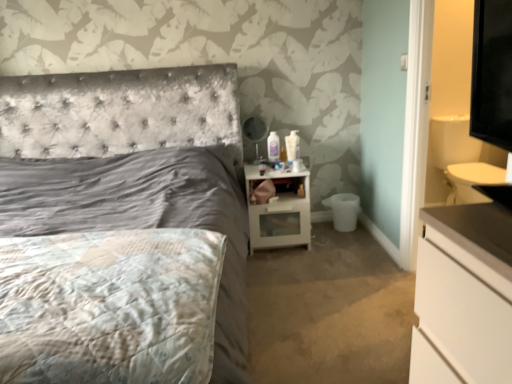
Question: Does point (156, 145) appear closer or farther from the camera than point (293, 153)?

Choices:
 (A) closer
 (B) farther

Answer: (A)

Question: From the image's perspective, is satin gray bed at center above or below white glossy lotion at upper center?

Choices:
 (A) below
 (B) above

Answer: (A)

Question: Which is farther from the fluffy white mattress at lower left?

Choices:
 (A) satin gray bed at center
 (B) matte black mirror at upper right
 (C) white glossy lotion at upper center
 (D) white glossy nightstand at center

Answer: (B)

Question: Which of these objects is positioned farthest from the fluffy white mattress at lower left?

Choices:
 (A) satin gray bed at center
 (B) matte black mirror at upper right
 (C) white glossy nightstand at center
 (D) white glossy lotion at upper center

Answer: (B)